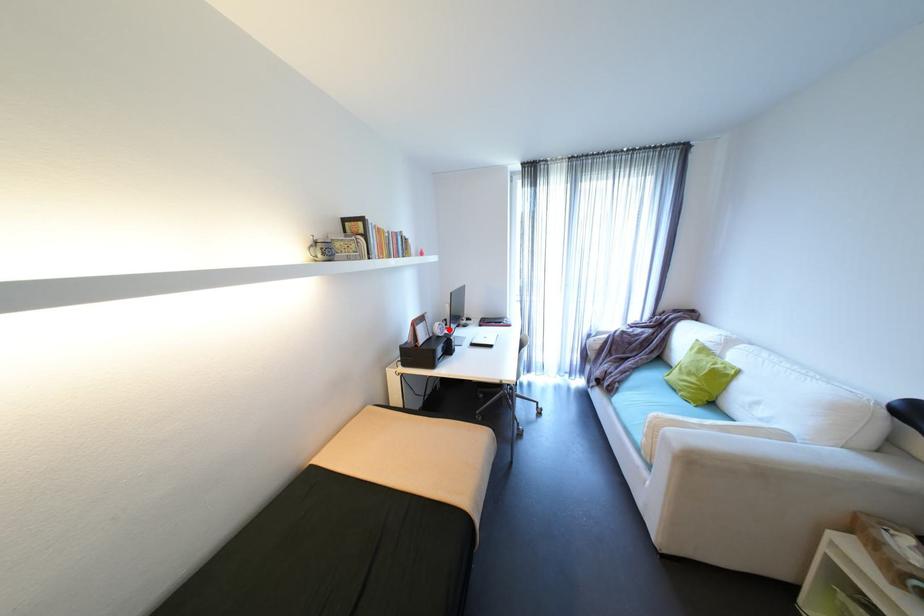
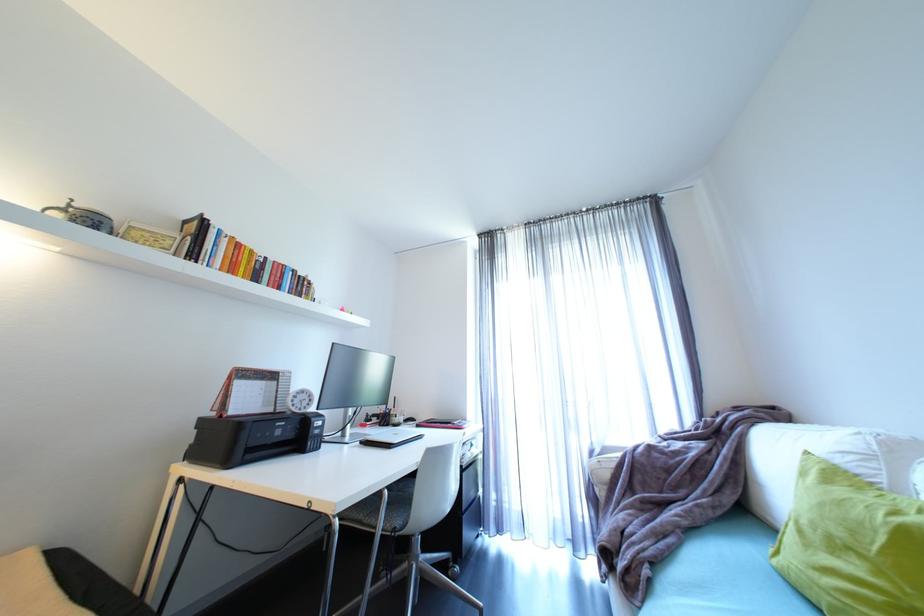
Locate, in the second image, the point that corresponds to the highlighted location in the first image.

(312, 402)